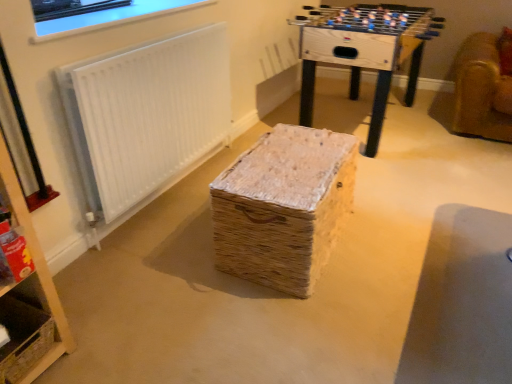
Question: Can you confirm if white textured radiator at upper left is shorter than woven straw basket at center?

Choices:
 (A) no
 (B) yes

Answer: (A)

Question: Is white textured radiator at upper left to the right of woven straw basket at center from the viewer's perspective?

Choices:
 (A) no
 (B) yes

Answer: (A)

Question: From a real-world perspective, is white textured radiator at upper left positioned under woven straw basket at center based on gravity?

Choices:
 (A) yes
 (B) no

Answer: (B)

Question: Is white textured radiator at upper left next to woven straw basket at center?

Choices:
 (A) no
 (B) yes

Answer: (A)

Question: Does white textured radiator at upper left appear on the left side of woven straw basket at center?

Choices:
 (A) yes
 (B) no

Answer: (A)

Question: From the image's perspective, is white textured radiator at upper left positioned above or below wooden foosball table at upper center?

Choices:
 (A) above
 (B) below

Answer: (B)

Question: Is point (185, 152) closer or farther from the camera than point (384, 82)?

Choices:
 (A) closer
 (B) farther

Answer: (A)

Question: Is white textured radiator at upper left inside or outside of wooden foosball table at upper center?

Choices:
 (A) inside
 (B) outside

Answer: (B)

Question: Relative to wooden foosball table at upper center, is white textured radiator at upper left in front or behind?

Choices:
 (A) front
 (B) behind

Answer: (A)

Question: Visually, is white textured radiator at upper left positioned to the left or to the right of woven straw basket at center?

Choices:
 (A) right
 (B) left

Answer: (B)

Question: Is point click(150, 59) closer or farther from the camera than point click(295, 268)?

Choices:
 (A) closer
 (B) farther

Answer: (B)

Question: In terms of size, does white textured radiator at upper left appear bigger or smaller than woven straw basket at center?

Choices:
 (A) small
 (B) big

Answer: (A)

Question: Looking at their shapes, would you say white textured radiator at upper left is wider or thinner than woven straw basket at center?

Choices:
 (A) wide
 (B) thin

Answer: (B)

Question: Would you say white textured radiator at upper left is to the left or to the right of clear glass window at upper left in the picture?

Choices:
 (A) right
 (B) left

Answer: (A)

Question: In terms of width, does white textured radiator at upper left look wider or thinner when compared to clear glass window at upper left?

Choices:
 (A) thin
 (B) wide

Answer: (A)